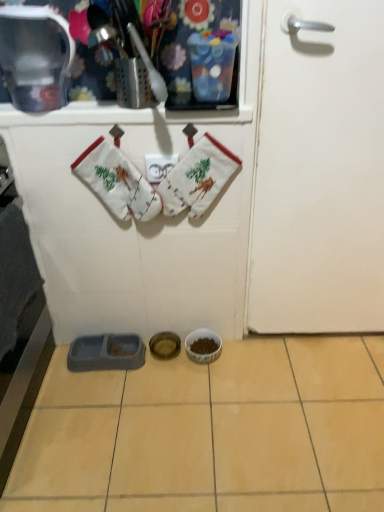
Question: From the image's perspective, is metallic silver container at upper left above white matte door at right?

Choices:
 (A) yes
 (B) no

Answer: (A)

Question: From the image's perspective, does metallic silver container at upper left appear lower than white matte door at right?

Choices:
 (A) no
 (B) yes

Answer: (A)

Question: Is metallic silver container at upper left surrounding white matte door at right?

Choices:
 (A) no
 (B) yes

Answer: (A)

Question: From a real-world perspective, is metallic silver container at upper left on top of white matte door at right?

Choices:
 (A) no
 (B) yes

Answer: (B)

Question: From a real-world perspective, is metallic silver container at upper left positioned under white matte door at right based on gravity?

Choices:
 (A) no
 (B) yes

Answer: (A)

Question: Considering the relative sizes of metallic silver container at upper left and white matte door at right in the image provided, is metallic silver container at upper left bigger than white matte door at right?

Choices:
 (A) no
 (B) yes

Answer: (A)

Question: Is white cotton oven mitts at upper center, positioned as the first baby clothe in left-to-right order, shorter than yellow ceramic tile at center?

Choices:
 (A) yes
 (B) no

Answer: (B)

Question: Is white cotton oven mitts at upper center, positioned as the first baby clothe in left-to-right order, facing away from yellow ceramic tile at center?

Choices:
 (A) yes
 (B) no

Answer: (B)

Question: Is white cotton oven mitts at upper center, marked as the second baby clothe in a right-to-left arrangement, completely or partially outside of yellow ceramic tile at center?

Choices:
 (A) no
 (B) yes

Answer: (B)

Question: From the image's perspective, is white cotton oven mitts at upper center, marked as the second baby clothe in a right-to-left arrangement, on top of yellow ceramic tile at center?

Choices:
 (A) yes
 (B) no

Answer: (A)

Question: Does white cotton oven mitts at upper center, positioned as the first baby clothe in left-to-right order, appear on the left side of yellow ceramic tile at center?

Choices:
 (A) yes
 (B) no

Answer: (A)

Question: Considering the relative positions of white cotton oven mitts at upper center, marked as the second baby clothe in a right-to-left arrangement, and yellow ceramic tile at center in the image provided, is white cotton oven mitts at upper center, marked as the second baby clothe in a right-to-left arrangement, in front of yellow ceramic tile at center?

Choices:
 (A) no
 (B) yes

Answer: (A)

Question: From the image's perspective, is white cotton oven mitts at upper center, positioned as the first baby clothe in left-to-right order, on top of metallic silver container at upper left?

Choices:
 (A) yes
 (B) no

Answer: (B)